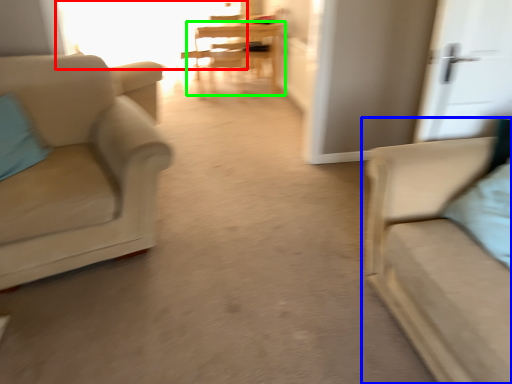
Question: Which is nearer to the window (highlighted by a red box)? studio couch (highlighted by a blue box) or table (highlighted by a green box).

Choices:
 (A) studio couch
 (B) table

Answer: (B)